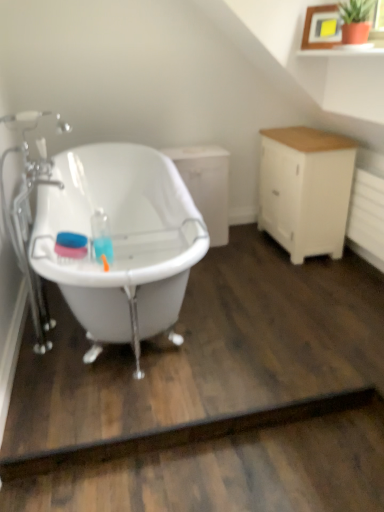
The image size is (384, 512). In order to click on vacant space in front of white wood cabinet at right, the first cabinetry viewed from the right in this screenshot , I will do `click(307, 277)`.